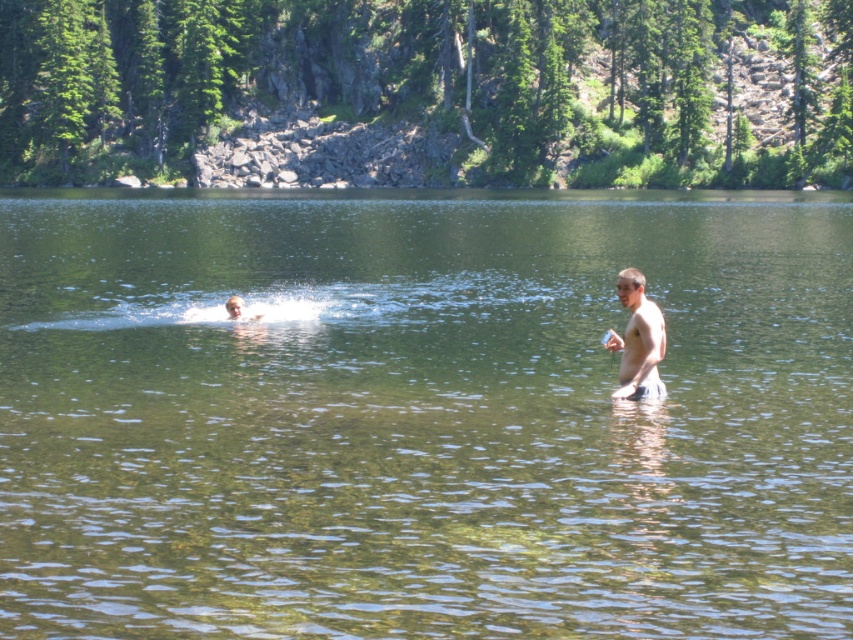
You are a swimmer who wants to cross from the left side of the lake to the right side. The clear water at center and the skinny white man at right are visible. Which direction should you swim to avoid the shallow area where the skinny white man is standing?

You should swim towards the clear water at center because it is wider than the area near the skinny white man at right, indicating deeper water where it is safer to swim.

Consider the image. You are a photographer positioned at the lakeside. You want to capture a photo that includes both the clear water at center and the skinny white man at right. Which object should you focus on first to ensure both are in sharp focus?

To ensure both the clear water at center and the skinny white man at right are in sharp focus, focus on the clear water at center first since it is closer to the viewer. This way, the skinny white man at right will also be within the depth of field.